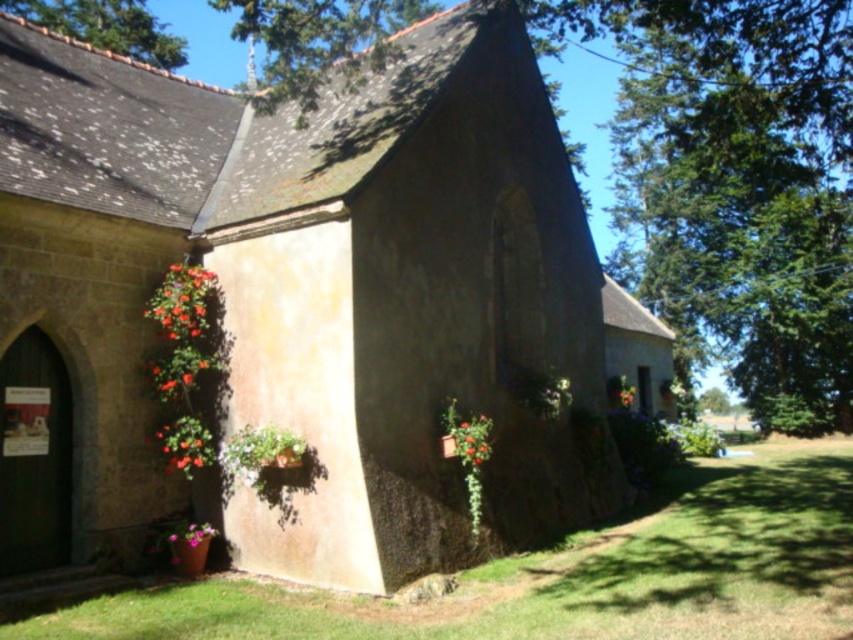
Question: Which point appears farthest from the camera in this image?

Choices:
 (A) (762, 97)
 (B) (212, 444)
 (C) (372, 465)
 (D) (189, 301)

Answer: (A)

Question: Is green leafy tree at center below matte plastic flower basket at upper left?

Choices:
 (A) no
 (B) yes

Answer: (A)

Question: Can you confirm if smooth stone chapel at center is positioned below green leafy tree at upper left?

Choices:
 (A) yes
 (B) no

Answer: (A)

Question: Among these objects, which one is farthest from the camera?

Choices:
 (A) pink matte flower at lower center
 (B) green leafy tree at upper left

Answer: (B)

Question: Which of these objects is positioned farthest from the matte plastic flower basket at upper left?

Choices:
 (A) matte red flower at lower center
 (B) matte red flower at lower left

Answer: (A)

Question: Does matte red flower at lower left appear under pink matte flower at lower center?

Choices:
 (A) yes
 (B) no

Answer: (B)